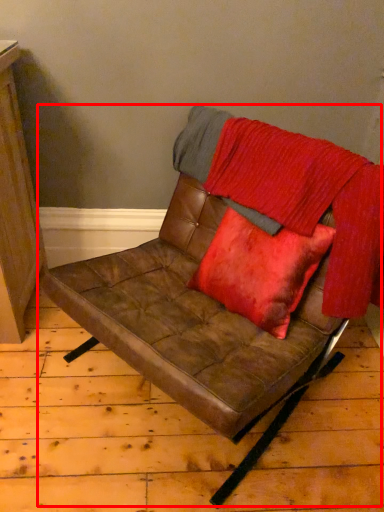
Question: From the image's perspective, what is the correct spatial positioning of chair (annotated by the red box) in reference to blanket?

Choices:
 (A) above
 (B) below

Answer: (B)